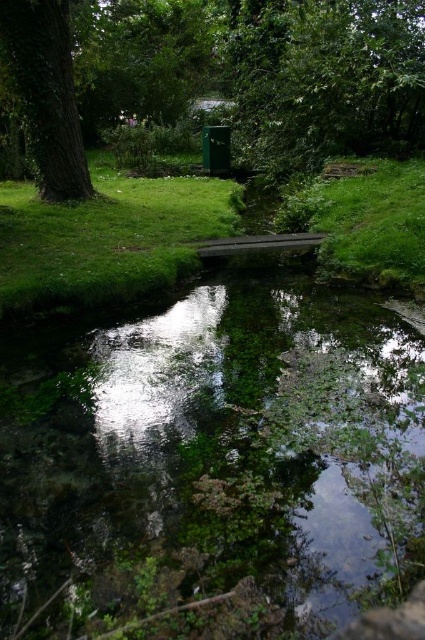
Question: Is green leafy tree at upper left closer to the viewer compared to green leafy tree at left?

Choices:
 (A) yes
 (B) no

Answer: (B)

Question: Which of the following is the farthest from the observer?

Choices:
 (A) (350, 108)
 (B) (234, 204)
 (C) (51, 33)

Answer: (A)

Question: Does green mossy stream at center appear over green leafy tree at left?

Choices:
 (A) yes
 (B) no

Answer: (B)

Question: Considering the real-world distances, which object is closest to the green leafy tree at upper left?

Choices:
 (A) green mossy stream at center
 (B) green grass at center

Answer: (B)

Question: Does green grass at center appear under green leafy tree at left?

Choices:
 (A) yes
 (B) no

Answer: (A)

Question: Which point is farther to the camera?

Choices:
 (A) (133, 493)
 (B) (81, 147)
 (C) (28, 12)

Answer: (B)